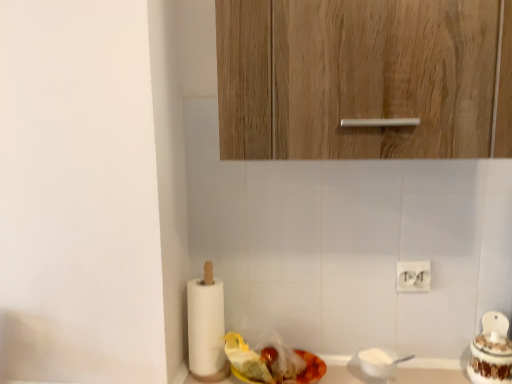
Question: Is shiny plastic container at lower center, placed as the second food when sorted from right to left, at the back of white paper at left?

Choices:
 (A) yes
 (B) no

Answer: (B)

Question: Is white paper at left shorter than shiny plastic container at lower center, placed as the second food when sorted from right to left?

Choices:
 (A) no
 (B) yes

Answer: (A)

Question: Considering the relative sizes of white paper at left and shiny plastic container at lower center, which is the first food in left-to-right order, in the image provided, is white paper at left smaller than shiny plastic container at lower center, which is the first food in left-to-right order,?

Choices:
 (A) yes
 (B) no

Answer: (A)

Question: From a real-world perspective, is white paper at left located higher than shiny plastic container at lower center, placed as the second food when sorted from right to left?

Choices:
 (A) yes
 (B) no

Answer: (A)

Question: Could shiny plastic container at lower center, which is the first food in left-to-right order, be considered to be inside white paper at left?

Choices:
 (A) yes
 (B) no

Answer: (B)

Question: Visually, is wooden cabinet at upper center positioned to the left or to the right of white glossy cake at right, the second food when ordered from left to right?

Choices:
 (A) right
 (B) left

Answer: (B)

Question: In terms of size, does wooden cabinet at upper center appear bigger or smaller than white glossy cake at right, placed as the 1th food when sorted from right to left?

Choices:
 (A) small
 (B) big

Answer: (B)

Question: From the image's perspective, is wooden cabinet at upper center above or below white glossy cake at right, the second food when ordered from left to right?

Choices:
 (A) above
 (B) below

Answer: (A)

Question: In terms of height, does wooden cabinet at upper center look taller or shorter compared to white glossy cake at right, the second food when ordered from left to right?

Choices:
 (A) tall
 (B) short

Answer: (A)

Question: In terms of height, does white glossy cake at right, the second food when ordered from left to right, look taller or shorter compared to shiny plastic container at lower center, placed as the second food when sorted from right to left?

Choices:
 (A) short
 (B) tall

Answer: (B)

Question: From the image's perspective, relative to shiny plastic container at lower center, placed as the second food when sorted from right to left, is white glossy cake at right, the second food when ordered from left to right, above or below?

Choices:
 (A) above
 (B) below

Answer: (A)

Question: Looking at their shapes, would you say white glossy cake at right, placed as the 1th food when sorted from right to left, is wider or thinner than shiny plastic container at lower center, which is the first food in left-to-right order?

Choices:
 (A) thin
 (B) wide

Answer: (A)

Question: Based on their sizes in the image, would you say white glossy cake at right, the second food when ordered from left to right, is bigger or smaller than shiny plastic container at lower center, which is the first food in left-to-right order?

Choices:
 (A) small
 (B) big

Answer: (A)

Question: From a real-world perspective, is white glossy cake at right, placed as the 1th food when sorted from right to left, positioned above or below wooden cabinet at upper center?

Choices:
 (A) below
 (B) above

Answer: (A)

Question: Is white glossy cake at right, the second food when ordered from left to right, inside the boundaries of wooden cabinet at upper center, or outside?

Choices:
 (A) inside
 (B) outside

Answer: (B)